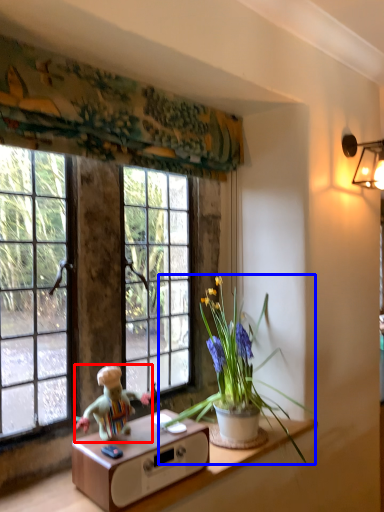
Question: Which object appears closest to the camera in this image, person (highlighted by a red box) or houseplant (highlighted by a blue box)?

Choices:
 (A) person
 (B) houseplant

Answer: (B)